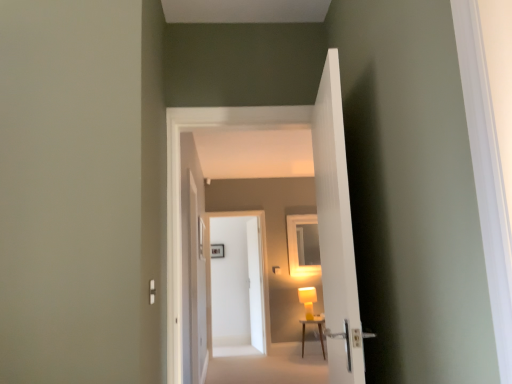
What is the approximate width of white ribbed door at center, positioned as the 4th door in back-to-front order?

white ribbed door at center, positioned as the 4th door in back-to-front order, is 6.55 inches wide.

Measure the distance between point [321,169] and camera.

Point [321,169] and camera are 1.95 meters apart from each other.

Find the location of a particular element. The height and width of the screenshot is (384, 512). white ribbed door at center, positioned as the 4th door in back-to-front order is located at coordinates (336, 231).

Does white glossy door at center, which ranks as the third door in back-to-front order, have a lesser height compared to matte yellow lamp at center?

No, white glossy door at center, which ranks as the third door in back-to-front order, is not shorter than matte yellow lamp at center.

Is white glossy door at center, arranged as the 2th door when viewed from the front, oriented towards matte yellow lamp at center?

No.

Looking at their sizes, would you say white glossy door at center, arranged as the 2th door when viewed from the front, is wider or thinner than matte yellow lamp at center?

Clearly, white glossy door at center, arranged as the 2th door when viewed from the front, has less width compared to matte yellow lamp at center.

You are a GUI agent. You are given a task and a screenshot of the screen. Output one action in this format:
    pyautogui.click(x=<x>, y=<y>)
    Task: Click on the corridor on the right of white glossy door at center, arranged as the 2th door when viewed from the front
    This screenshot has width=512, height=384.
    Given the screenshot: What is the action you would take?
    pyautogui.click(x=320, y=209)

How distant is white glossy door at center, the first door from the back, from white carpet at lower center?

white glossy door at center, the first door from the back, is 28.05 inches away from white carpet at lower center.

Where is `path in front of the white glossy door at center, the first door from the back`? path in front of the white glossy door at center, the first door from the back is located at coordinates (268, 365).

Is white glossy door at center, the first door from the back, next to white carpet at lower center and touching it?

No, white glossy door at center, the first door from the back, is not touching white carpet at lower center.

In the scene shown: Considering the sizes of objects white glossy door at center, the first door from the back, and white carpet at lower center in the image provided, who is bigger, white glossy door at center, the first door from the back, or white carpet at lower center?

With larger size is white carpet at lower center.

Can you confirm if matte yellow table lamp at center is positioned to the right of white glossy door at center, which is the second door in back-to-front order?

Yes.

Is matte yellow table lamp at center aimed at white glossy door at center, marked as the third door in a front-to-back arrangement?

No, matte yellow table lamp at center does not turn towards white glossy door at center, marked as the third door in a front-to-back arrangement.

Considering the sizes of objects matte yellow table lamp at center and white glossy door at center, marked as the third door in a front-to-back arrangement, in the image provided, who is thinner, matte yellow table lamp at center or white glossy door at center, marked as the third door in a front-to-back arrangement,?

With smaller width is white glossy door at center, marked as the third door in a front-to-back arrangement.

Considering the relative sizes of matte yellow table lamp at center and white glossy door at center, marked as the third door in a front-to-back arrangement, in the image provided, is matte yellow table lamp at center taller than white glossy door at center, marked as the third door in a front-to-back arrangement,?

Incorrect, the height of matte yellow table lamp at center is not larger of that of white glossy door at center, marked as the third door in a front-to-back arrangement.

Which of these two, white ribbed door at center, positioned as the 4th door in back-to-front order, or white plastic light switch at lower left, is bigger?

With larger size is white ribbed door at center, positioned as the 4th door in back-to-front order.

Based on the photo, from the image's perspective, is white ribbed door at center, positioned as the 4th door in back-to-front order, below white plastic light switch at lower left?

Actually, white ribbed door at center, positioned as the 4th door in back-to-front order, appears above white plastic light switch at lower left in the image.

Is white ribbed door at center, which is the 1th door in front-to-back order, taller than white plastic light switch at lower left?

Correct, white ribbed door at center, which is the 1th door in front-to-back order, is much taller as white plastic light switch at lower left.

Between matte yellow table lamp at center and white glossy door at center, the first door from the back, which one has larger width?

matte yellow table lamp at center is wider.

Based on the photo, choose the correct answer: Is matte yellow table lamp at center inside white glossy door at center, the first door from the back, or outside it?

matte yellow table lamp at center is spatially situated outside white glossy door at center, the first door from the back.

Does matte yellow table lamp at center turn towards white glossy door at center, arranged as the fourth door when viewed from the front?

No, matte yellow table lamp at center is not oriented towards white glossy door at center, arranged as the fourth door when viewed from the front.

Does point (300, 292) lie in front of point (259, 250)?

No.

Which is more to the left, wooden table at center or matte yellow table lamp at center?

Positioned to the left is matte yellow table lamp at center.

In order to click on table lamp located on the left of wooden table at center in this screenshot , I will do `click(308, 300)`.

Which of these two, wooden table at center or matte yellow table lamp at center, is bigger?

wooden table at center is bigger.

Is matte yellow table lamp at center inside wooden table at center?

No, matte yellow table lamp at center is not a part of wooden table at center.

From the image's perspective, between white glossy door at center, the first door from the back, and matte yellow lamp at center, who is located below?

white glossy door at center, the first door from the back, is shown below in the image.

Is matte yellow lamp at center inside white glossy door at center, the first door from the back?

No, matte yellow lamp at center is not inside white glossy door at center, the first door from the back.

Where is `the 3rd door positioned below the matte yellow lamp at center (from a real-world perspective)`? The width and height of the screenshot is (512, 384). the 3rd door positioned below the matte yellow lamp at center (from a real-world perspective) is located at coordinates (256, 285).

Which of these two, white glossy door at center, the first door from the back, or matte yellow lamp at center, is wider?

Wider between the two is matte yellow lamp at center.

In order to click on corridor in front of the white glossy door at center, arranged as the 2th door when viewed from the front in this screenshot , I will do `click(320, 209)`.

Where is `path below the white glossy door at center, the first door from the back (from the image's perspective)`? This screenshot has width=512, height=384. path below the white glossy door at center, the first door from the back (from the image's perspective) is located at coordinates (268, 365).

Considering their positions, is white glossy door at center, which ranks as the third door in back-to-front order, positioned closer to white glossy door at center, the first door from the back, than wooden table at center?

wooden table at center is closer to white glossy door at center, the first door from the back.

Looking at the image, which one is located further to wooden table at center, white glossy door at center, which ranks as the third door in back-to-front order, or white ribbed door at center, positioned as the 4th door in back-to-front order?

white ribbed door at center, positioned as the 4th door in back-to-front order, is positioned further to the anchor wooden table at center.

Considering their positions, is white glossy door at center, the first door from the back, positioned further to matte yellow table lamp at center than white glossy door at center, which is the second door in back-to-front order?

white glossy door at center, which is the second door in back-to-front order, is further to matte yellow table lamp at center.

When comparing their distances from white carpet at lower center, does white plastic light switch at lower left or white glossy door at center, arranged as the fourth door when viewed from the front, seem further?

white plastic light switch at lower left is positioned further to the anchor white carpet at lower center.

When comparing their distances from white plastic light switch at lower left, does matte yellow table lamp at center or white glossy door at center, which ranks as the third door in back-to-front order, seem further?

matte yellow table lamp at center is further to white plastic light switch at lower left.

Estimate the real-world distances between objects in this image. Which object is closer to white ribbed door at center, positioned as the 4th door in back-to-front order, matte yellow table lamp at center or wooden table at center?

matte yellow table lamp at center is positioned closer to the anchor white ribbed door at center, positioned as the 4th door in back-to-front order.

When comparing their distances from white plastic light switch at lower left, does white glossy door at center, which ranks as the third door in back-to-front order, or white glossy door at center, arranged as the fourth door when viewed from the front, seem further?

white glossy door at center, arranged as the fourth door when viewed from the front, lies further to white plastic light switch at lower left than the other object.

Considering their positions, is white ribbed door at center, positioned as the 4th door in back-to-front order, positioned closer to white carpet at lower center than matte yellow lamp at center?

matte yellow lamp at center is positioned closer to the anchor white carpet at lower center.

Where is `corridor between white plastic light switch at lower left and white carpet at lower center from front to back`? The height and width of the screenshot is (384, 512). corridor between white plastic light switch at lower left and white carpet at lower center from front to back is located at coordinates (320, 209).

Find the location of a particular element. Image resolution: width=512 pixels, height=384 pixels. table lamp between matte yellow lamp at center and white glossy door at center, which is the second door in back-to-front order, in the front-back direction is located at coordinates (308, 300).

Find the location of a particular element. path located between white plastic light switch at lower left and white glossy door at center, marked as the third door in a front-to-back arrangement, in the depth direction is located at coordinates (268, 365).

The width and height of the screenshot is (512, 384). Find the location of `table lamp between white glossy door at center, arranged as the 2th door when viewed from the front, and white glossy door at center, marked as the third door in a front-to-back arrangement, from front to back`. table lamp between white glossy door at center, arranged as the 2th door when viewed from the front, and white glossy door at center, marked as the third door in a front-to-back arrangement, from front to back is located at coordinates (308, 300).